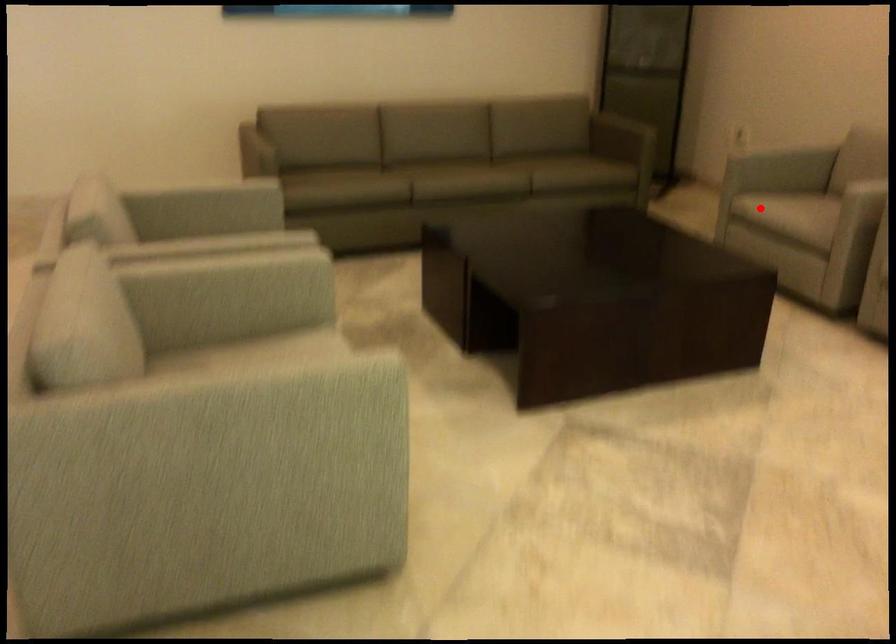
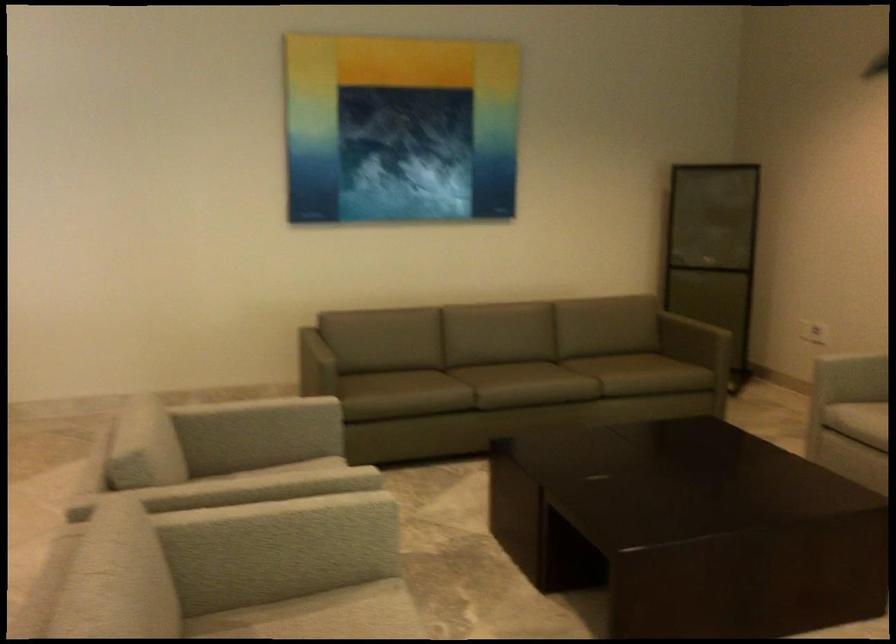
In the second image, find the point that corresponds to the highlighted location in the first image.

(857, 420)